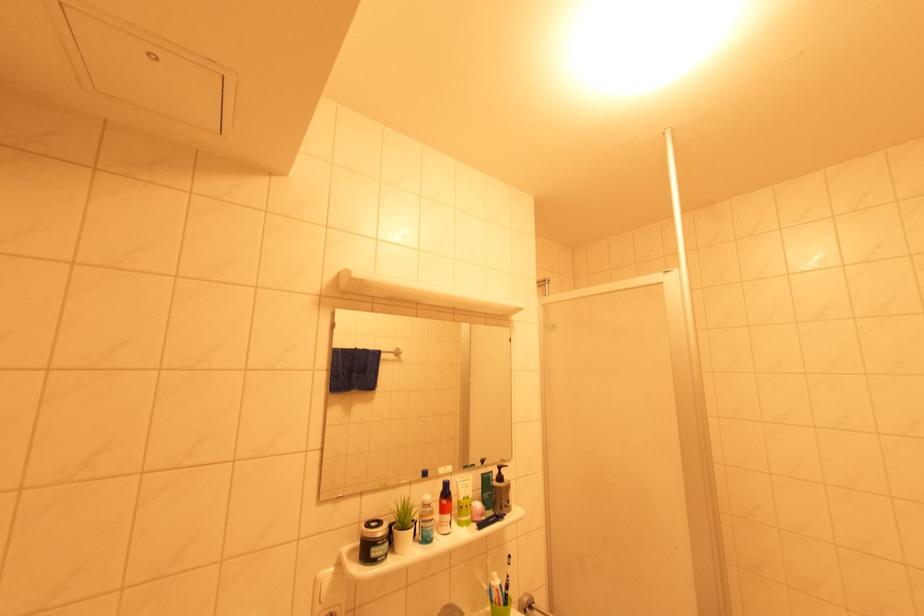
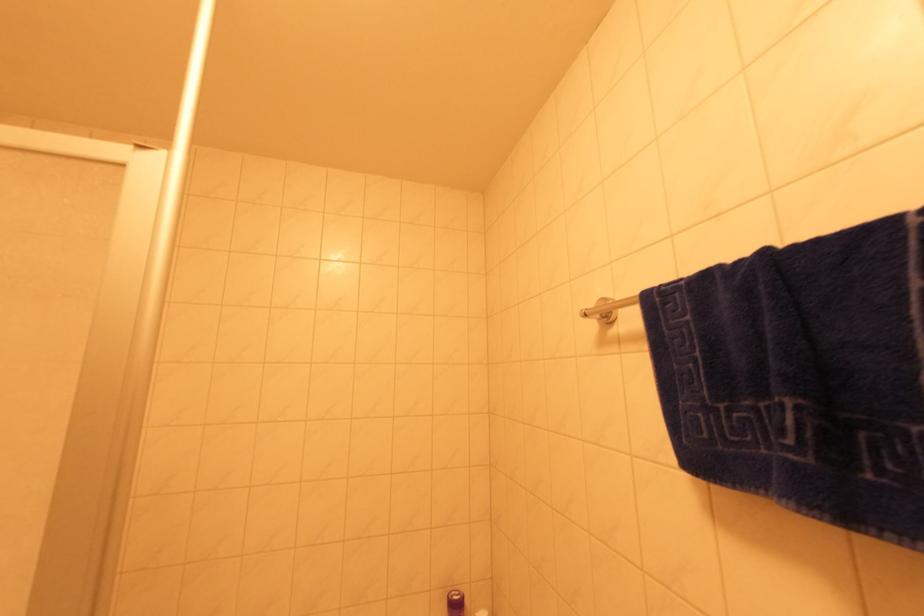
Question: The camera is either moving clockwise (left) or counter-clockwise (right) around the object. The first image is from the beginning of the video and the second image is from the end. Is the camera moving left or right when shooting the video?

Choices:
 (A) Left
 (B) Right

Answer: (A)